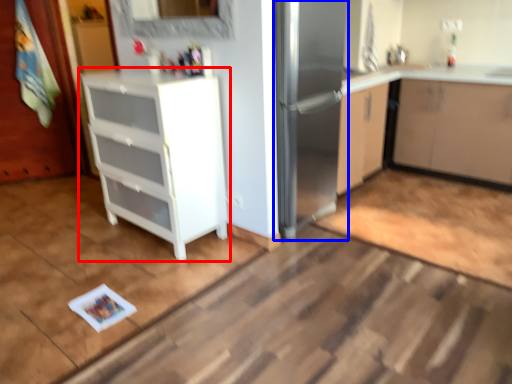
Question: Which object appears closest to the camera in this image, cabinetry (highlighted by a red box) or fridge (highlighted by a blue box)?

Choices:
 (A) cabinetry
 (B) fridge

Answer: (A)